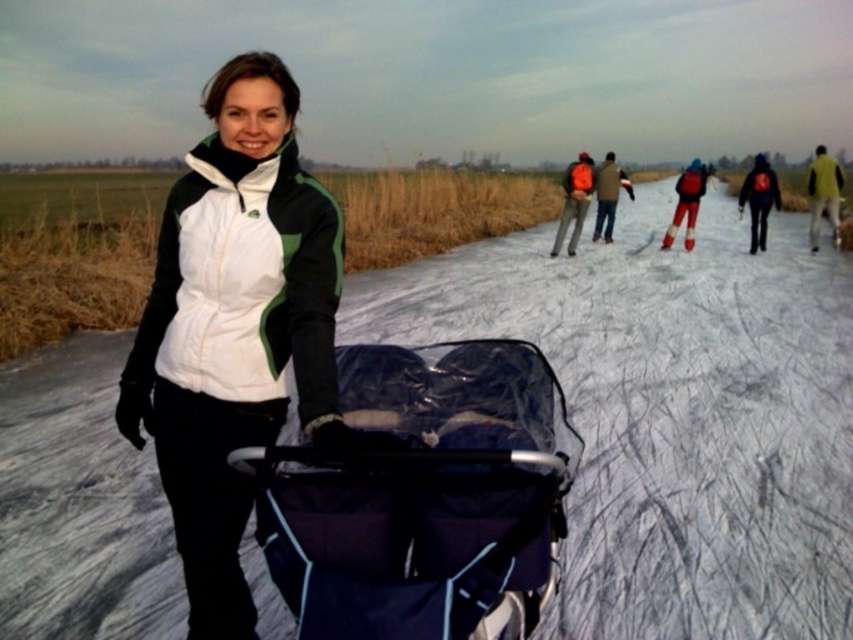
In the scene shown: You are a photographer trying to capture a clear shot of the dark blue fabric baby carriage at center. However, the white matte snow at center is blocking your view. Can you adjust your angle to see the entire carriage without the snow obscuring it?

The white matte snow at center is taller than the dark blue fabric baby carriage at center, so adjusting your angle downward might allow you to see the entire carriage without the snow blocking it.

You are a photographer trying to capture a photo of the woman in the scene. You notice both the white fleece jacket at center and the orange jacket at center. Which jacket is closer to the camera?

The white fleece jacket at center is below the orange jacket at center, meaning it is closer to the camera.